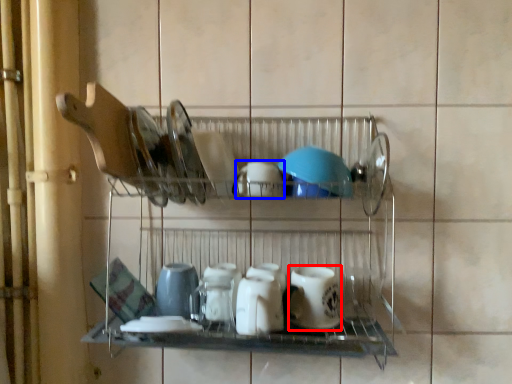
Question: Which point is closer to the camera, tableware (highlighted by a red box) or tableware (highlighted by a blue box)?

Choices:
 (A) tableware
 (B) tableware

Answer: (B)